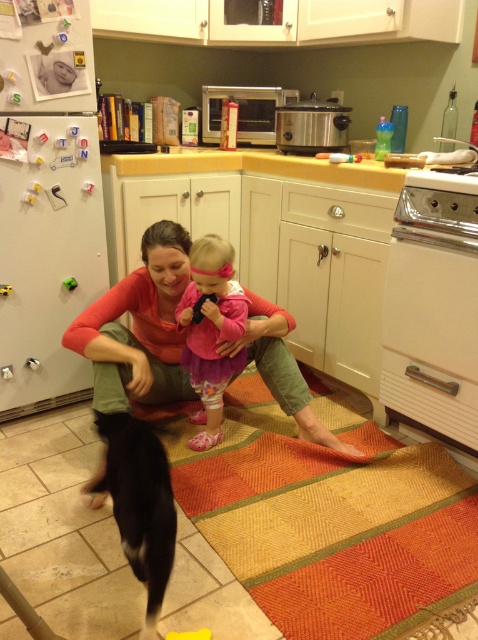
Between matte orange shirt at center and pink satin dress at center, which one is positioned lower?

matte orange shirt at center

In order to click on matte orange shirt at center in this screenshot , I will do tap(139, 326).